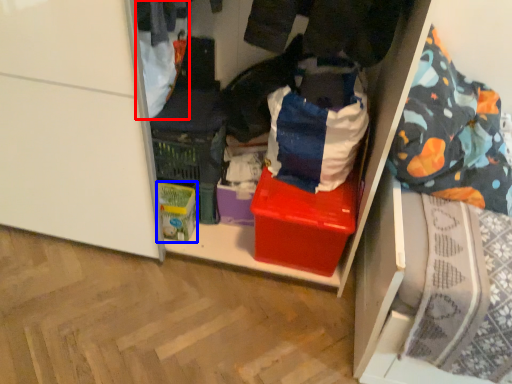
Question: Which point is closer to the camera, clothing (highlighted by a red box) or storage box (highlighted by a blue box)?

Choices:
 (A) clothing
 (B) storage box

Answer: (A)